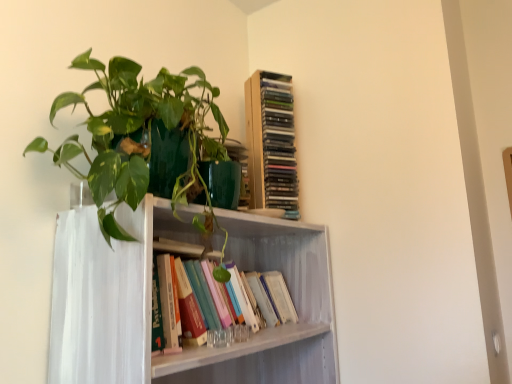
Image resolution: width=512 pixels, height=384 pixels. What do you see at coordinates (271, 143) in the screenshot?
I see `wooden cd tower at upper center, the second book ordered from the bottom` at bounding box center [271, 143].

The width and height of the screenshot is (512, 384). What are the coordinates of `green glossy plant at upper left` in the screenshot? It's located at (135, 131).

You are a GUI agent. You are given a task and a screenshot of the screen. Output one action in this format:
    pyautogui.click(x=<x>, y=<y>)
    Task: Click on the hardcover books at center, which is the first book from bottom to top
    This screenshot has width=512, height=384.
    Given the screenshot: What is the action you would take?
    pyautogui.click(x=195, y=305)

Between point (255, 202) and point (111, 187), which one is positioned in front?

The point (111, 187) is in front.

Looking at the image, does wooden cd tower at upper center, the second book ordered from the bottom, seem bigger or smaller compared to green glossy plant at upper left?

Clearly, wooden cd tower at upper center, the second book ordered from the bottom, is smaller in size than green glossy plant at upper left.

From a real-world perspective, which is physically above, wooden cd tower at upper center, the second book ordered from the bottom, or green glossy plant at upper left?

In real-world perspective, wooden cd tower at upper center, the second book ordered from the bottom, is above.

Who is taller, wooden cd tower at upper center, the first book in the top-to-bottom sequence, or green glossy plant at upper left?

wooden cd tower at upper center, the first book in the top-to-bottom sequence, is taller.

From a real-world perspective, which is physically above, white painted wood shelf at center or hardcover books at center, the 2th book in the top-to-bottom sequence?

In real-world perspective, hardcover books at center, the 2th book in the top-to-bottom sequence, is above.

From the image's perspective, which is above, white painted wood shelf at center or hardcover books at center, which is the first book from bottom to top?

hardcover books at center, which is the first book from bottom to top.

Identify the location of shelf that appears below the hardcover books at center, which is the first book from bottom to top (from a real-world perspective). Image resolution: width=512 pixels, height=384 pixels. (150, 302).

Can you confirm if white painted wood shelf at center is taller than hardcover books at center, the 2th book in the top-to-bottom sequence?

Correct, white painted wood shelf at center is much taller as hardcover books at center, the 2th book in the top-to-bottom sequence.

Consider the image. Considering the relative sizes of white painted wood shelf at center and wooden cd tower at upper center, the first book in the top-to-bottom sequence, in the image provided, is white painted wood shelf at center thinner than wooden cd tower at upper center, the first book in the top-to-bottom sequence,?

In fact, white painted wood shelf at center might be wider than wooden cd tower at upper center, the first book in the top-to-bottom sequence.

Could wooden cd tower at upper center, the first book in the top-to-bottom sequence, be considered to be inside white painted wood shelf at center?

No, wooden cd tower at upper center, the first book in the top-to-bottom sequence, is not a part of white painted wood shelf at center.

From the picture: From the image's perspective, is white painted wood shelf at center located above or below wooden cd tower at upper center, the second book ordered from the bottom?

Clearly, from the image's perspective, white painted wood shelf at center is below wooden cd tower at upper center, the second book ordered from the bottom.

Image resolution: width=512 pixels, height=384 pixels. What are the coordinates of `houseplant located on the left of white painted wood shelf at center` in the screenshot? It's located at (135, 131).

How many degrees apart are the facing directions of green glossy plant at upper left and white painted wood shelf at center?

0.000176 degrees separate the facing orientations of green glossy plant at upper left and white painted wood shelf at center.

From the image's perspective, is green glossy plant at upper left on top of white painted wood shelf at center?

Yes, from the image's perspective, green glossy plant at upper left is above white painted wood shelf at center.

In the scene shown: Is green glossy plant at upper left surrounding white painted wood shelf at center?

That's incorrect, white painted wood shelf at center is not inside green glossy plant at upper left.

Is green glossy plant at upper left positioned beyond the bounds of wooden cd tower at upper center, the second book ordered from the bottom?

Yes.

Which is nearer, (134, 157) or (251, 149)?

Point (134, 157) appears to be closer to the viewer than point (251, 149).

You are a GUI agent. You are given a task and a screenshot of the screen. Output one action in this format:
    pyautogui.click(x=<x>, y=<y>)
    Task: Click on the 2nd book behind the green glossy plant at upper left, starting your count from the anchor
    This screenshot has height=384, width=512.
    Given the screenshot: What is the action you would take?
    pyautogui.click(x=271, y=143)

Which of these two, white painted wood shelf at center or green glossy plant at upper left, stands shorter?

green glossy plant at upper left.

Would you say white painted wood shelf at center is outside green glossy plant at upper left?

That's correct, white painted wood shelf at center is outside of green glossy plant at upper left.

Is white painted wood shelf at center smaller than green glossy plant at upper left?

Incorrect, white painted wood shelf at center is not smaller in size than green glossy plant at upper left.

Which is more distant, (185, 295) or (252, 109)?

Positioned behind is point (252, 109).

Considering their positions, is hardcover books at center, which is the first book from bottom to top, located in front of or behind wooden cd tower at upper center, the first book in the top-to-bottom sequence?

In the image, hardcover books at center, which is the first book from bottom to top, appears in front of wooden cd tower at upper center, the first book in the top-to-bottom sequence.

Is hardcover books at center, which is the first book from bottom to top, taller or shorter than wooden cd tower at upper center, the second book ordered from the bottom?

Considering their sizes, hardcover books at center, which is the first book from bottom to top, has less height than wooden cd tower at upper center, the second book ordered from the bottom.

Find the location of a particular element. This screenshot has width=512, height=384. book positioned vertically above the green glossy plant at upper left (from a real-world perspective) is located at coordinates (271, 143).

Where is `shelf below the hardcover books at center, the 2th book in the top-to-bottom sequence (from a real-world perspective)`? This screenshot has width=512, height=384. shelf below the hardcover books at center, the 2th book in the top-to-bottom sequence (from a real-world perspective) is located at coordinates (150, 302).

Estimate the real-world distances between objects in this image. Which object is closer to wooden cd tower at upper center, the second book ordered from the bottom, hardcover books at center, the 2th book in the top-to-bottom sequence, or green glossy plant at upper left?

Among the two, green glossy plant at upper left is located nearer to wooden cd tower at upper center, the second book ordered from the bottom.

Looking at the image, which one is located further to green glossy plant at upper left, hardcover books at center, which is the first book from bottom to top, or wooden cd tower at upper center, the second book ordered from the bottom?

wooden cd tower at upper center, the second book ordered from the bottom, lies further to green glossy plant at upper left than the other object.

Which object lies further to the anchor point green glossy plant at upper left, white painted wood shelf at center or hardcover books at center, which is the first book from bottom to top?

hardcover books at center, which is the first book from bottom to top.

Estimate the real-world distances between objects in this image. Which object is further from hardcover books at center, which is the first book from bottom to top, white painted wood shelf at center or wooden cd tower at upper center, the second book ordered from the bottom?

Among the two, wooden cd tower at upper center, the second book ordered from the bottom, is located further to hardcover books at center, which is the first book from bottom to top.

Estimate the real-world distances between objects in this image. Which object is further from green glossy plant at upper left, white painted wood shelf at center or wooden cd tower at upper center, the second book ordered from the bottom?

Among the two, wooden cd tower at upper center, the second book ordered from the bottom, is located further to green glossy plant at upper left.

Considering their positions, is white painted wood shelf at center positioned further to hardcover books at center, which is the first book from bottom to top, than green glossy plant at upper left?

green glossy plant at upper left is positioned further to the anchor hardcover books at center, which is the first book from bottom to top.

When comparing their distances from wooden cd tower at upper center, the second book ordered from the bottom, does green glossy plant at upper left or white painted wood shelf at center seem closer?

The object closer to wooden cd tower at upper center, the second book ordered from the bottom, is white painted wood shelf at center.

Estimate the real-world distances between objects in this image. Which object is further from hardcover books at center, which is the first book from bottom to top, green glossy plant at upper left or wooden cd tower at upper center, the second book ordered from the bottom?

wooden cd tower at upper center, the second book ordered from the bottom, is positioned further to the anchor hardcover books at center, which is the first book from bottom to top.

This screenshot has height=384, width=512. In order to click on shelf positioned between green glossy plant at upper left and wooden cd tower at upper center, the second book ordered from the bottom, from near to far in this screenshot , I will do `click(150, 302)`.

You are a GUI agent. You are given a task and a screenshot of the screen. Output one action in this format:
    pyautogui.click(x=<x>, y=<y>)
    Task: Click on the book positioned between white painted wood shelf at center and wooden cd tower at upper center, the second book ordered from the bottom, from near to far
    
    Given the screenshot: What is the action you would take?
    pyautogui.click(x=195, y=305)

Locate an element on the screen. This screenshot has height=384, width=512. book between green glossy plant at upper left and white painted wood shelf at center in the up-down direction is located at coordinates (195, 305).

You are a GUI agent. You are given a task and a screenshot of the screen. Output one action in this format:
    pyautogui.click(x=<x>, y=<y>)
    Task: Click on the book between green glossy plant at upper left and wooden cd tower at upper center, the first book in the top-to-bottom sequence, in the front-back direction
    The image size is (512, 384).
    Given the screenshot: What is the action you would take?
    pyautogui.click(x=195, y=305)